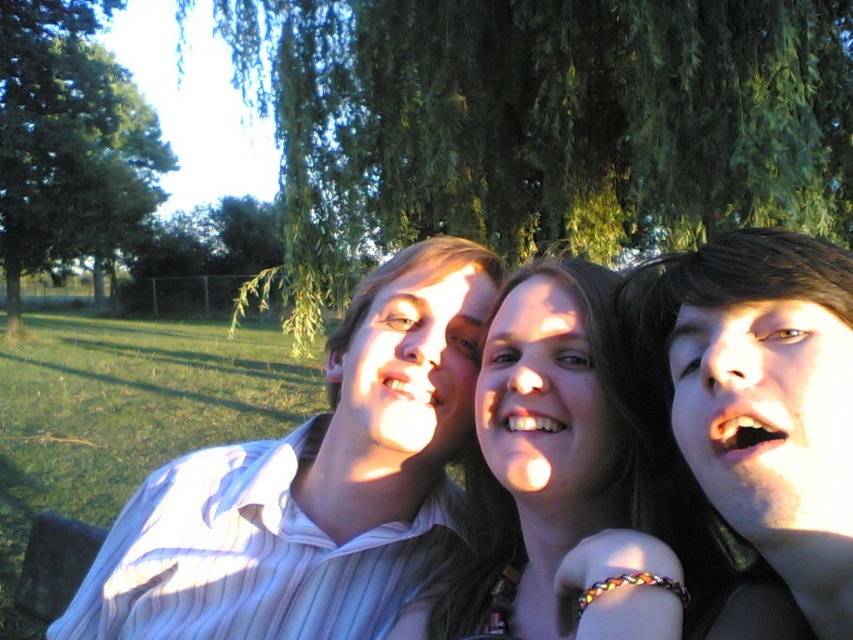
Consider the image. You are a photographer trying to capture a photo of the three people in the park. You want to focus on the person at point [689,273] and the person at point [12,35]. Which of these two people is closer to the camera?

The person at point [689,273] is closer to the camera than the person at point [12,35].